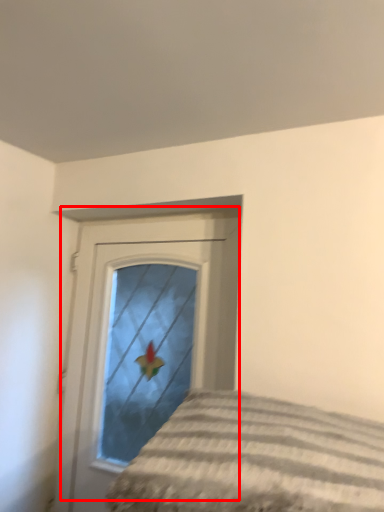
Question: From the image, what is the correct spatial relationship of door (annotated by the red box) in relation to bed?

Choices:
 (A) right
 (B) left

Answer: (B)